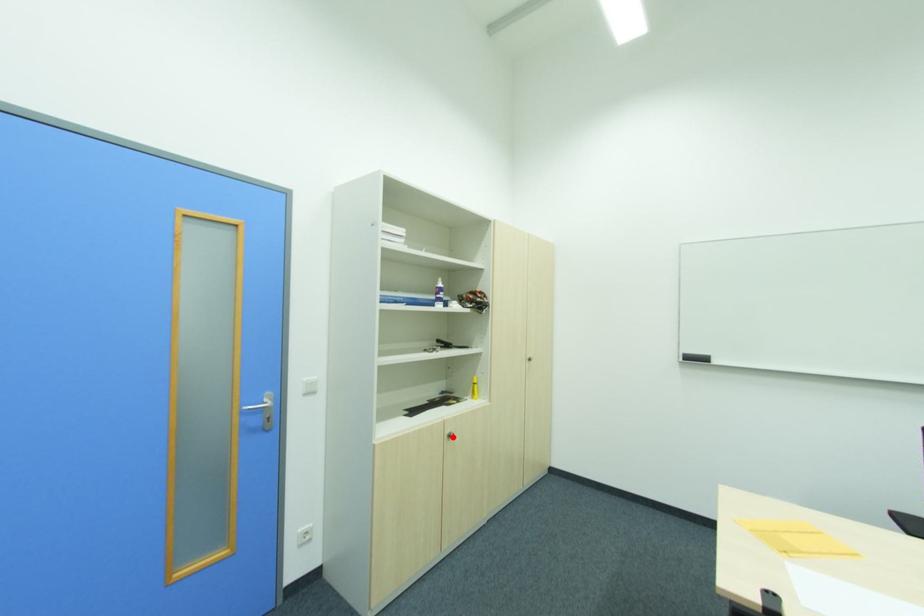
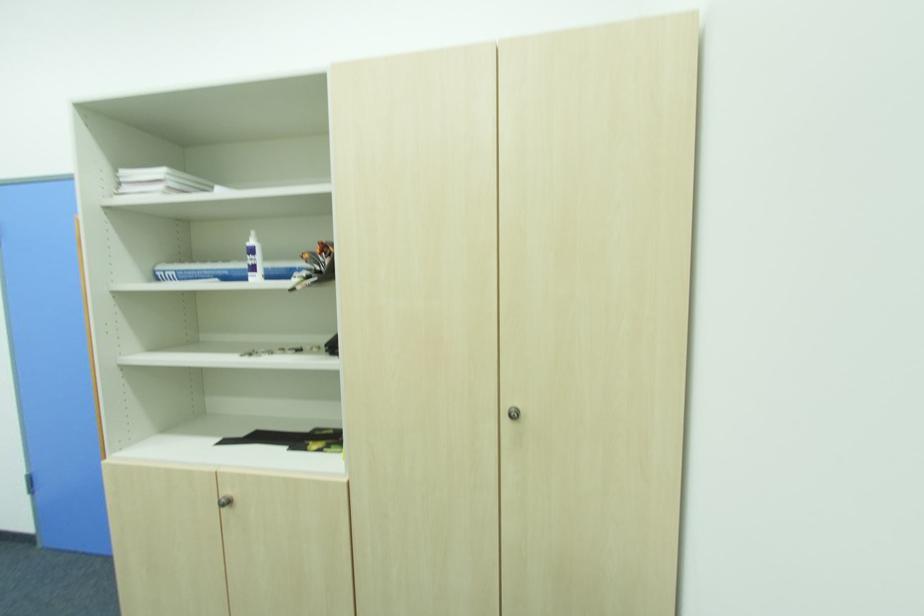
Find the pixel in the second image that matches the highlighted location in the first image.

(229, 504)